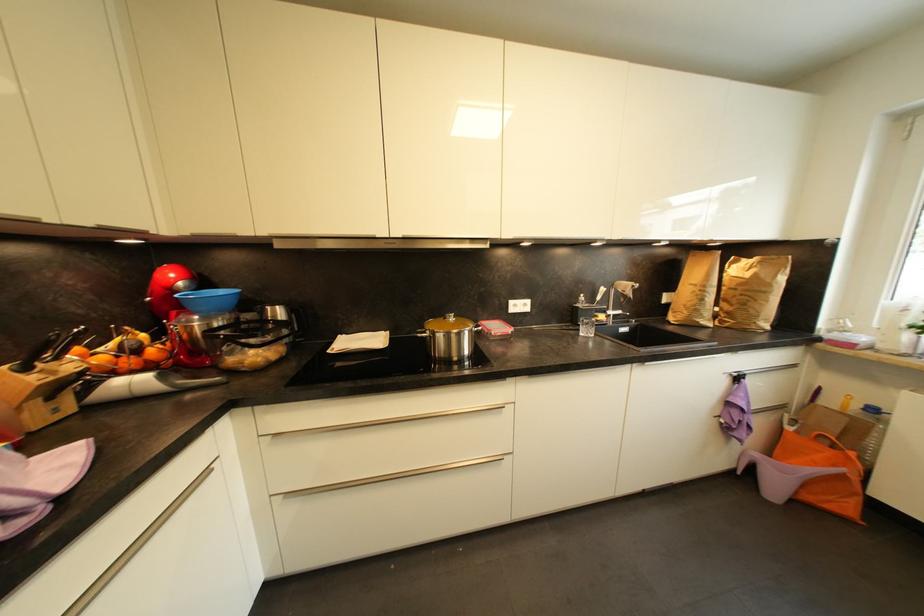
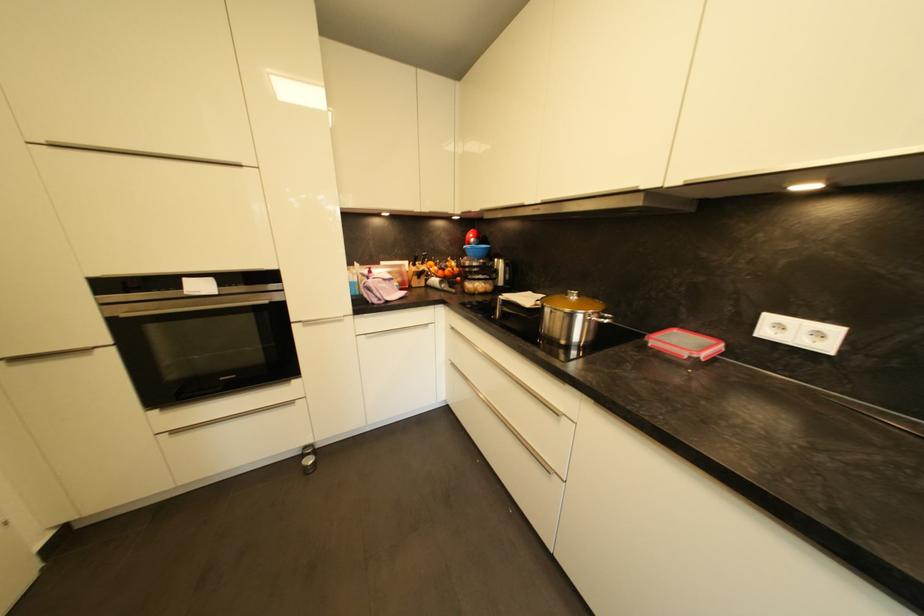
Question: The camera is either moving clockwise (left) or counter-clockwise (right) around the object. The first image is from the beginning of the video and the second image is from the end. Is the camera moving left or right when shooting the video?

Choices:
 (A) Left
 (B) Right

Answer: (B)